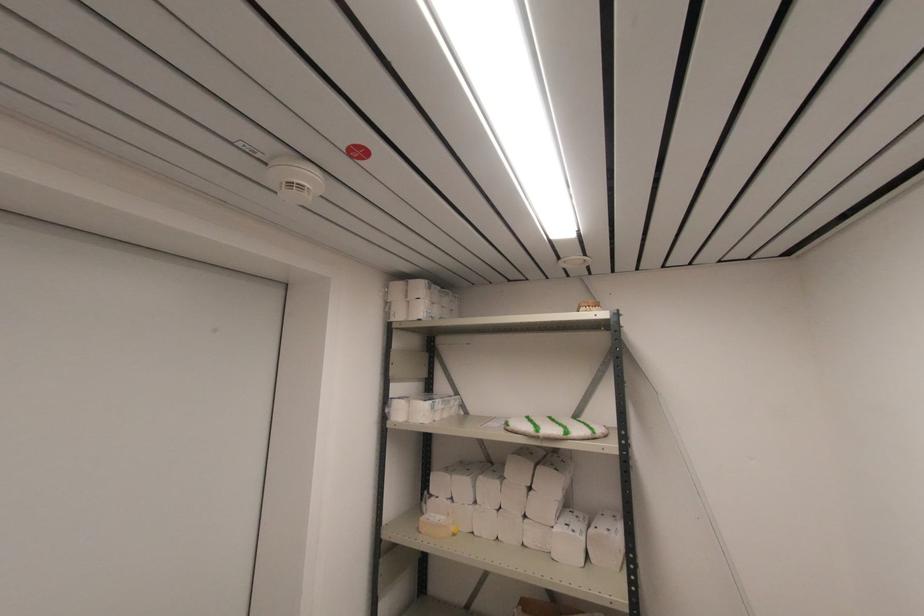
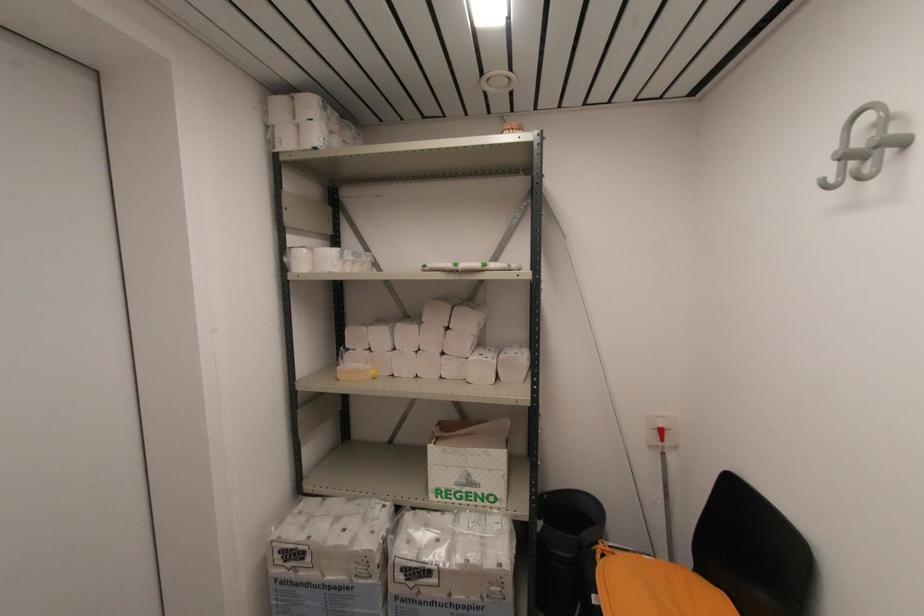
Locate, in the second image, the point that corresponds to the point at 444,406 in the first image.

(353, 257)